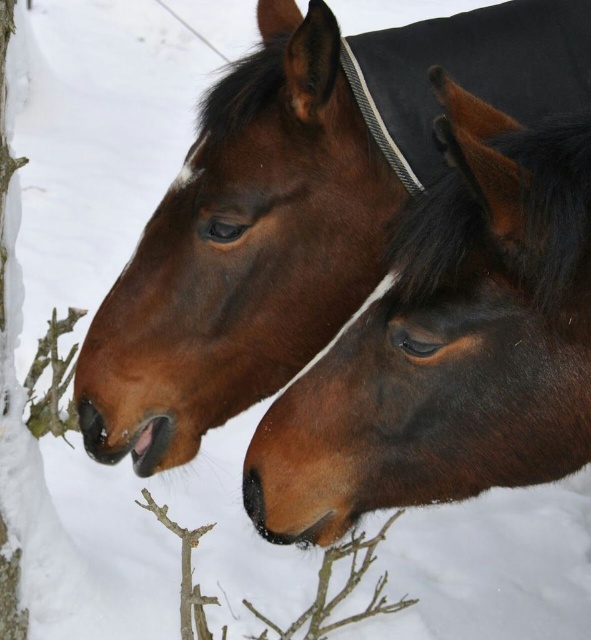
You are a photographer trying to capture a closeup shot of the brown glossy horse at center and the brown woody branch at lower center. Which object should you focus on first to ensure the subject is in sharp focus?

The brown glossy horse at center is closer to the viewer than the brown woody branch at lower center, so you should focus on the brown glossy horse at center first to ensure it is in sharp focus.

You are a photographer trying to capture a closeup of the brown woody branch at lower center without the brown glossy horse at center blocking the view. Is the branch visible from your current position?

The brown glossy horse at center is located above the brown woody branch at lower center, so the horse is blocking the direct view of the branch. To capture the branch without obstruction, you need to adjust your position to a lower angle or move to the side to avoid the horse.